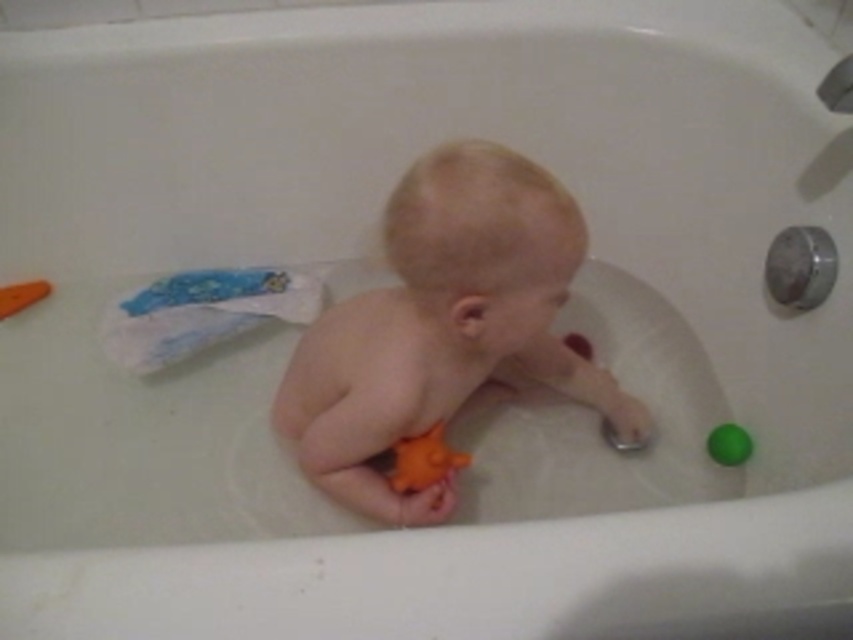
You are a parent checking the items in the bathtub. You see the white paper diaper at upper left and the green rubber ball at right. Which item is taller?

The white paper diaper at upper left is taller than the green rubber ball at right.

You are a parent trying to decide which toy to give your baby first. The baby is currently holding the orange rubber toy at left. You see the green rubber ball at right nearby. Based on their sizes, which toy should you pick up first to ensure it fits comfortably in your hand?

The green rubber ball at right is shorter than the orange rubber toy at left, so it might be easier to grasp first due to its smaller size.